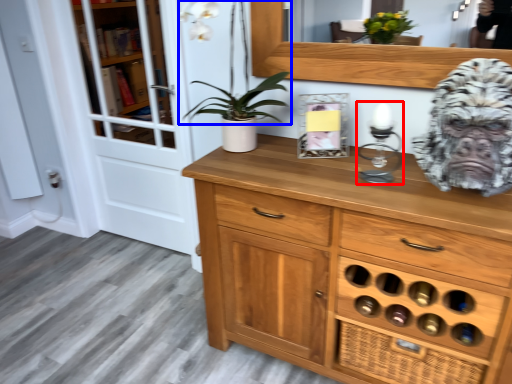
Question: Which of the following is the closest to the observer, candle holder (highlighted by a red box) or plant (highlighted by a blue box)?

Choices:
 (A) candle holder
 (B) plant

Answer: (A)